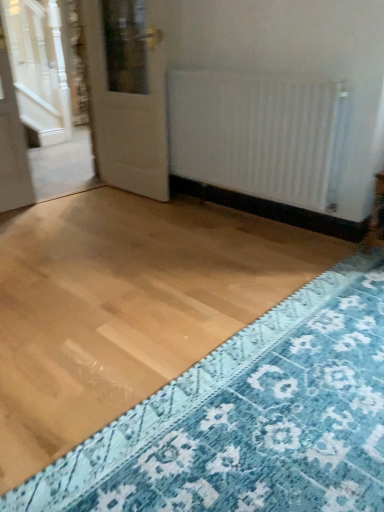
Find the location of a particular element. Image resolution: width=384 pixels, height=512 pixels. vacant space in white glossy door at upper left (from a real-world perspective) is located at coordinates (128, 194).